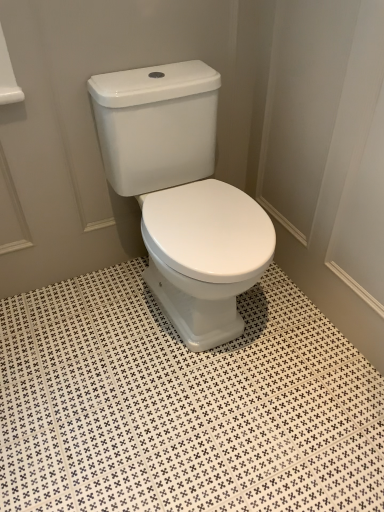
You are a GUI agent. You are given a task and a screenshot of the screen. Output one action in this format:
    pyautogui.click(x=<x>, y=<y>)
    Task: Click on the free spot above white glossy ceramic tile at center (from a real-world perspective)
    This screenshot has width=384, height=512.
    Given the screenshot: What is the action you would take?
    pyautogui.click(x=174, y=386)